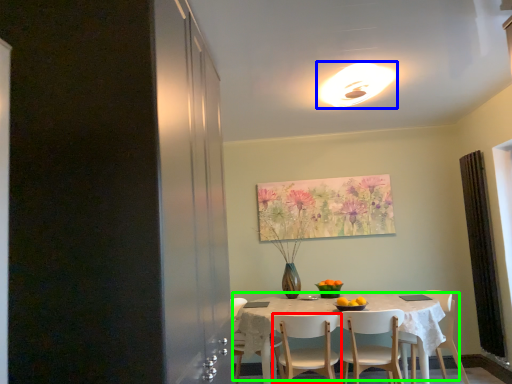
Question: Considering the real-world distances, which object is farthest from chair (highlighted by a red box)? light fixture (highlighted by a blue box) or kitchen & dining room table (highlighted by a green box)?

Choices:
 (A) light fixture
 (B) kitchen & dining room table

Answer: (A)